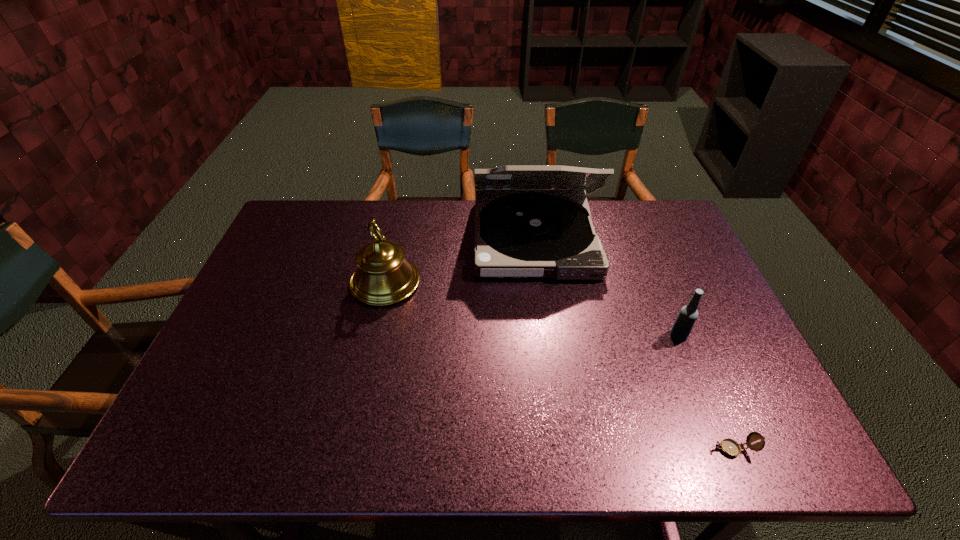
I want to click on vacant space at the near edge, so click(x=623, y=440).

In the image, there is a desktop. At what (x,y) coordinates should I click in order to perform the action: click on vacant space at the right edge. Please return your answer as a coordinate pair (x, y). Looking at the image, I should click on (683, 251).

Image resolution: width=960 pixels, height=540 pixels. What are the coordinates of `blank space at the far left corner of the desktop` in the screenshot? It's located at (334, 205).

Identify the location of vacant space at the near left corner of the desktop. The height and width of the screenshot is (540, 960). (x=192, y=430).

Where is `free space between the tallest object and the third farthest object`? free space between the tallest object and the third farthest object is located at coordinates (607, 287).

The height and width of the screenshot is (540, 960). Identify the location of vacant space that is in between the tallest object and the bell. (460, 260).

Locate an element on the screen. This screenshot has height=540, width=960. free space between the third farthest object and the leftmost object is located at coordinates (532, 309).

The height and width of the screenshot is (540, 960). What are the coordinates of `free area in between the second object from left to right and the leftmost object` in the screenshot? It's located at (460, 260).

You are a GUI agent. You are given a task and a screenshot of the screen. Output one action in this format:
    pyautogui.click(x=<x>, y=<y>)
    Task: Click on the vacant area that lies between the CD player and the third tallest object
    This screenshot has width=960, height=540.
    Given the screenshot: What is the action you would take?
    pyautogui.click(x=607, y=287)

Where is `free point between the bell and the tallest object`? free point between the bell and the tallest object is located at coordinates (460, 260).